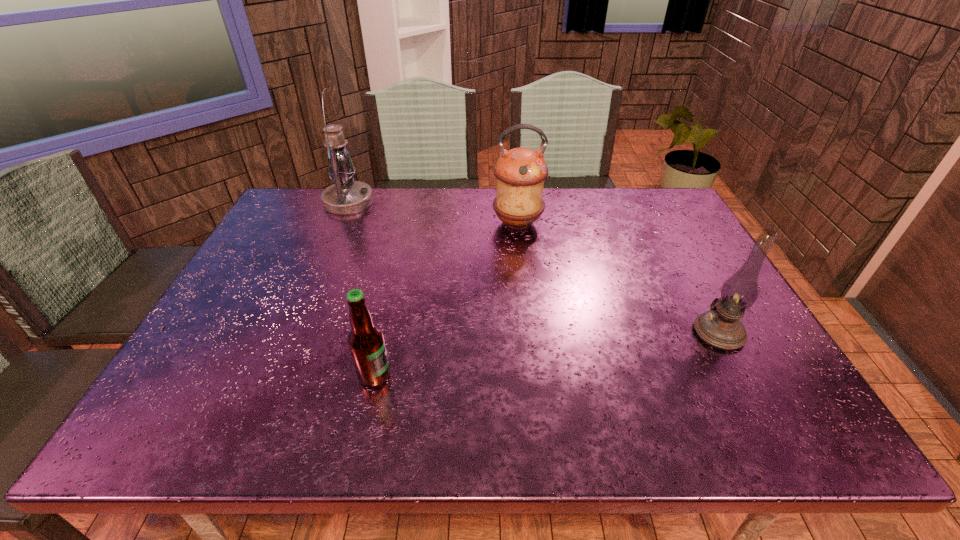
At what (x,y) coordinates should I click in order to perform the action: click on object that is at the left edge. Please return your answer as a coordinate pair (x, y). Looking at the image, I should click on (346, 196).

Find the location of a particular element. The height and width of the screenshot is (540, 960). object that is at the right edge is located at coordinates pyautogui.click(x=720, y=327).

This screenshot has width=960, height=540. What are the coordinates of `object that is at the far left corner` in the screenshot? It's located at (346, 196).

This screenshot has height=540, width=960. What are the coordinates of `vacant space at the far edge of the desktop` in the screenshot? It's located at (414, 188).

Locate an element on the screen. The height and width of the screenshot is (540, 960). vacant area at the near edge of the desktop is located at coordinates (530, 403).

Identify the location of free spot at the left edge of the desktop. (236, 282).

Image resolution: width=960 pixels, height=540 pixels. In the image, there is a desktop. Find the location of `free space at the right edge`. free space at the right edge is located at coordinates (708, 251).

Locate an element on the screen. The height and width of the screenshot is (540, 960). vacant region at the near right corner of the desktop is located at coordinates (800, 438).

Where is `unoccupied position between the leftmost oil lamp and the second nearest object`? The height and width of the screenshot is (540, 960). unoccupied position between the leftmost oil lamp and the second nearest object is located at coordinates (534, 267).

Locate an element on the screen. The image size is (960, 540). free space between the rightmost oil lamp and the second oil lamp from right to left is located at coordinates (618, 278).